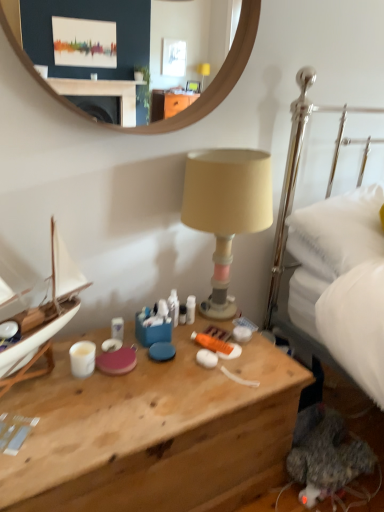
Where is `empty space that is ontop of wooden desk at center (from a real-world perspective)`? The width and height of the screenshot is (384, 512). empty space that is ontop of wooden desk at center (from a real-world perspective) is located at coordinates (139, 372).